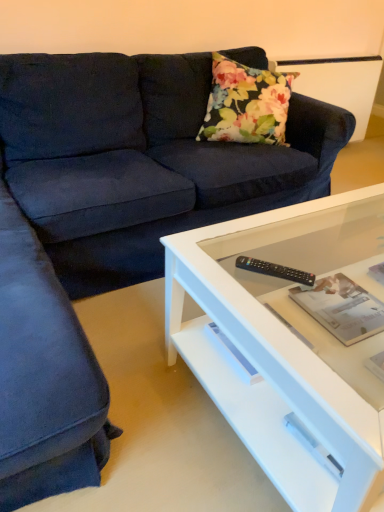
This screenshot has width=384, height=512. Find the location of `black plastic remote at center`. black plastic remote at center is located at coordinates (275, 270).

Measure the distance between black plastic remote at center and camera.

A distance of 1.02 meters exists between black plastic remote at center and camera.

In order to face black plastic remote at center, should I rotate leftwards or rightwards?

You should look right and rotate roughly 10.807 degrees.

Describe the element at coordinates (275, 270) in the screenshot. Image resolution: width=384 pixels, height=512 pixels. I see `black plastic remote at center` at that location.

Identify the location of black plastic remote at center. (275, 270).